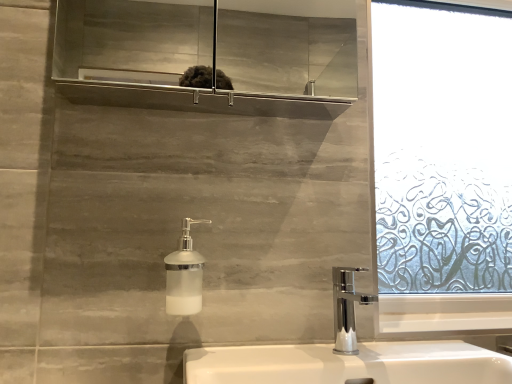
Question: Is white frosted glass soap dispenser at center bigger or smaller than white ceramic sink at lower center?

Choices:
 (A) small
 (B) big

Answer: (A)

Question: In the image, is white frosted glass soap dispenser at center positioned in front of or behind white ceramic sink at lower center?

Choices:
 (A) front
 (B) behind

Answer: (B)

Question: From a real-world perspective, is white frosted glass soap dispenser at center above or below white ceramic sink at lower center?

Choices:
 (A) below
 (B) above

Answer: (B)

Question: Is white ceramic sink at lower center bigger or smaller than white frosted glass soap dispenser at center?

Choices:
 (A) big
 (B) small

Answer: (A)

Question: In terms of height, does white ceramic sink at lower center look taller or shorter compared to white frosted glass soap dispenser at center?

Choices:
 (A) short
 (B) tall

Answer: (B)

Question: From the image's perspective, is white ceramic sink at lower center located above or below white frosted glass soap dispenser at center?

Choices:
 (A) above
 (B) below

Answer: (B)

Question: Considering the positions of white ceramic sink at lower center and white frosted glass soap dispenser at center in the image, is white ceramic sink at lower center wider or thinner than white frosted glass soap dispenser at center?

Choices:
 (A) thin
 (B) wide

Answer: (B)